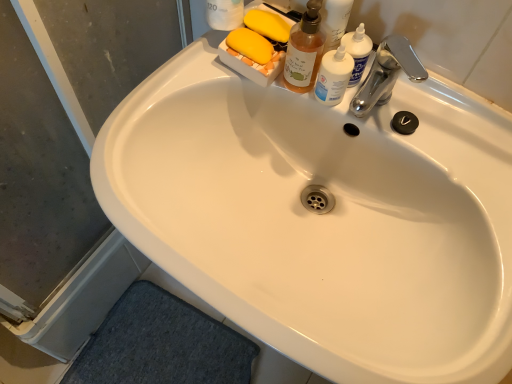
Question: Is transparent plastic screen door at lower left completely or partially outside of translucent amber liquid soap dispenser at upper center?

Choices:
 (A) no
 (B) yes

Answer: (B)

Question: Would you say transparent plastic screen door at lower left is a long distance from translucent amber liquid soap dispenser at upper center?

Choices:
 (A) no
 (B) yes

Answer: (A)

Question: Does transparent plastic screen door at lower left come in front of translucent amber liquid soap dispenser at upper center?

Choices:
 (A) no
 (B) yes

Answer: (B)

Question: Does transparent plastic screen door at lower left touch translucent amber liquid soap dispenser at upper center?

Choices:
 (A) yes
 (B) no

Answer: (B)

Question: Can you confirm if transparent plastic screen door at lower left is positioned to the left of translucent amber liquid soap dispenser at upper center?

Choices:
 (A) no
 (B) yes

Answer: (B)

Question: From a real-world perspective, is chrome metallic faucet at upper right physically located above or below translucent plastic bottle at upper right?

Choices:
 (A) below
 (B) above

Answer: (B)

Question: Considering the positions of chrome metallic faucet at upper right and translucent plastic bottle at upper right in the image, is chrome metallic faucet at upper right wider or thinner than translucent plastic bottle at upper right?

Choices:
 (A) thin
 (B) wide

Answer: (B)

Question: From the image's perspective, is chrome metallic faucet at upper right positioned above or below translucent plastic bottle at upper right?

Choices:
 (A) above
 (B) below

Answer: (B)

Question: Is point (372, 87) positioned closer to the camera than point (328, 82)?

Choices:
 (A) closer
 (B) farther

Answer: (B)

Question: From the image's perspective, is chrome metallic faucet at upper right located above or below translucent amber liquid soap dispenser at upper center?

Choices:
 (A) below
 (B) above

Answer: (A)

Question: Considering the positions of chrome metallic faucet at upper right and translucent amber liquid soap dispenser at upper center in the image, is chrome metallic faucet at upper right bigger or smaller than translucent amber liquid soap dispenser at upper center?

Choices:
 (A) small
 (B) big

Answer: (B)

Question: Choose the correct answer: Is chrome metallic faucet at upper right inside translucent amber liquid soap dispenser at upper center or outside it?

Choices:
 (A) outside
 (B) inside

Answer: (A)

Question: From a real-world perspective, is chrome metallic faucet at upper right above or below translucent amber liquid soap dispenser at upper center?

Choices:
 (A) above
 (B) below

Answer: (B)

Question: From a real-world perspective, is transparent plastic screen door at lower left above or below chrome metallic faucet at upper right?

Choices:
 (A) above
 (B) below

Answer: (B)

Question: In terms of width, does transparent plastic screen door at lower left look wider or thinner when compared to chrome metallic faucet at upper right?

Choices:
 (A) thin
 (B) wide

Answer: (A)